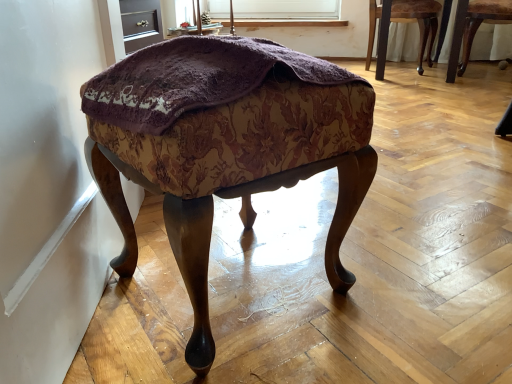
Question: Considering the relative positions of wooden chair at right, marked as the second chair in a left-to-right arrangement, and wooden chair at upper right, the first chair viewed from the left, in the image provided, is wooden chair at right, marked as the second chair in a left-to-right arrangement, to the left or to the right of wooden chair at upper right, the first chair viewed from the left,?

Choices:
 (A) right
 (B) left

Answer: (A)

Question: From the image's perspective, is wooden chair at right, marked as the second chair in a left-to-right arrangement, positioned above or below wooden chair at upper right, which is counted as the 2th chair, starting from the right?

Choices:
 (A) above
 (B) below

Answer: (B)

Question: Which of these objects is positioned closest to the velvet-like fabric stool at center?

Choices:
 (A) wooden chair at right, marked as the second chair in a left-to-right arrangement
 (B) wooden chair at upper right, the first chair viewed from the left
 (C) matte purple fabric at upper center

Answer: (C)

Question: Which is nearer to the wooden chair at upper right, the first chair viewed from the left?

Choices:
 (A) wooden chair at right, arranged as the 1th chair when viewed from the right
 (B) matte purple fabric at upper center
 (C) velvet-like fabric stool at center

Answer: (A)